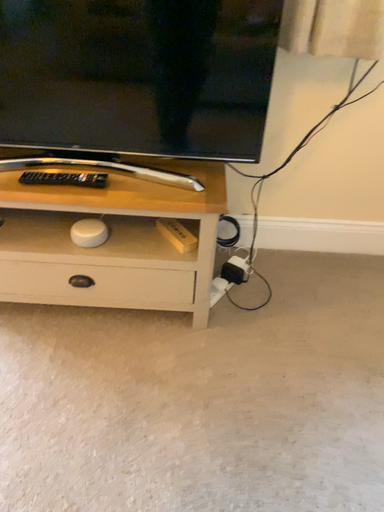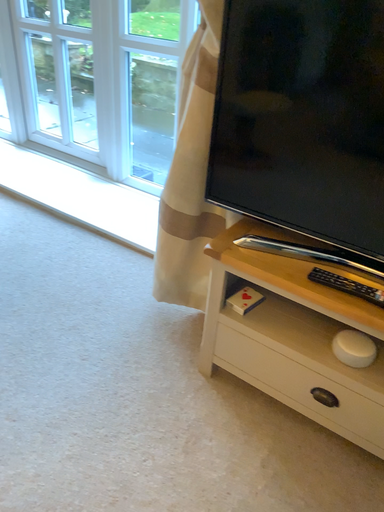
Question: How did the camera likely rotate when shooting the video?

Choices:
 (A) rotated left
 (B) rotated right

Answer: (A)